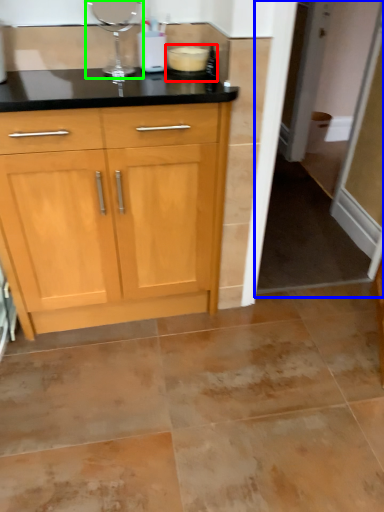
Question: Which is farther away from appliance (highlighted by a red box)? screen door (highlighted by a blue box) or appliance (highlighted by a green box)?

Choices:
 (A) screen door
 (B) appliance

Answer: (A)